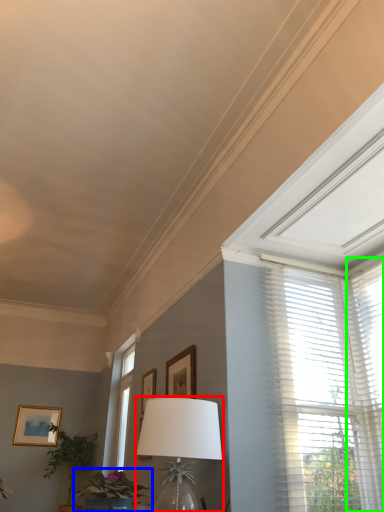
Question: Based on their relative distances, which object is nearer to table lamp (highlighted by a red box)? Choose from houseplant (highlighted by a blue box) and window blind (highlighted by a green box).

Choices:
 (A) houseplant
 (B) window blind

Answer: (A)